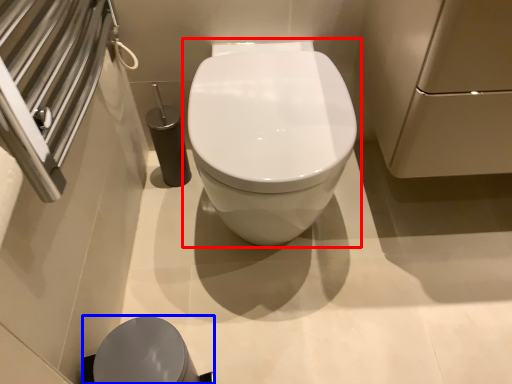
Question: Which object is further to the camera taking this photo, toilet (highlighted by a red box) or porcelain (highlighted by a blue box)?

Choices:
 (A) toilet
 (B) porcelain

Answer: (A)